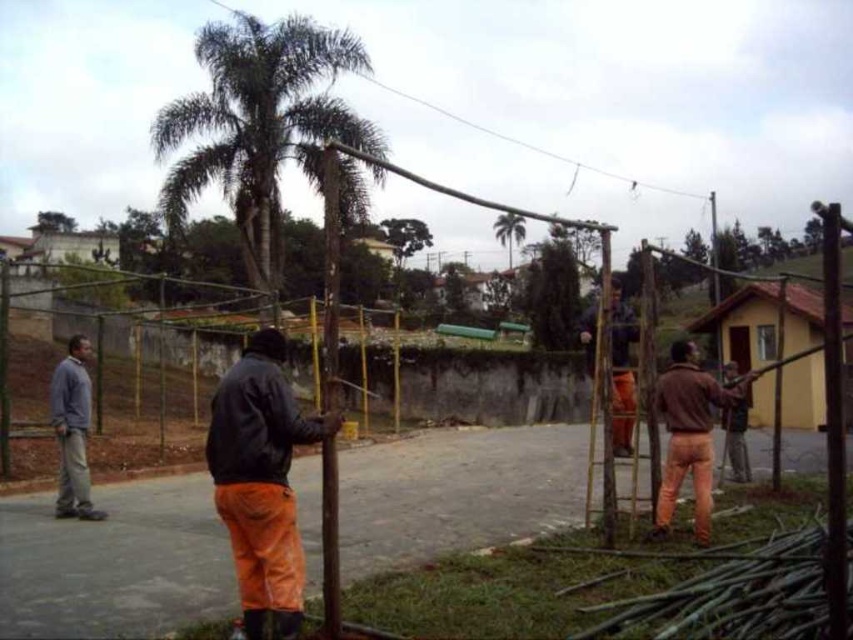
Question: Which of the following is the closest to the observer?

Choices:
 (A) 590,321
 (B) 222,472
 (C) 512,236

Answer: (B)

Question: Does orange fabric pants at center have a larger size compared to green leafy palm tree at upper center?

Choices:
 (A) no
 (B) yes

Answer: (A)

Question: Considering the relative positions of brown matte jacket at center and orange fabric construction worker at center in the image provided, where is brown matte jacket at center located with respect to orange fabric construction worker at center?

Choices:
 (A) above
 (B) below

Answer: (B)

Question: Where is orange fabric construction worker at center located in relation to brown wooden pole at upper center in the image?

Choices:
 (A) left
 (B) right

Answer: (B)

Question: Which object is positioned farthest from the green leafy tree at upper center?

Choices:
 (A) brown wooden pole at upper center
 (B) brown matte jacket at center
 (C) gray sweater at left
 (D) rusty metal telegraph pole at center

Answer: (B)

Question: Estimate the real-world distances between objects in this image. Which object is farther from the green leafy palm tree at upper left?

Choices:
 (A) gray sweater at left
 (B) orange fabric construction worker at center

Answer: (B)